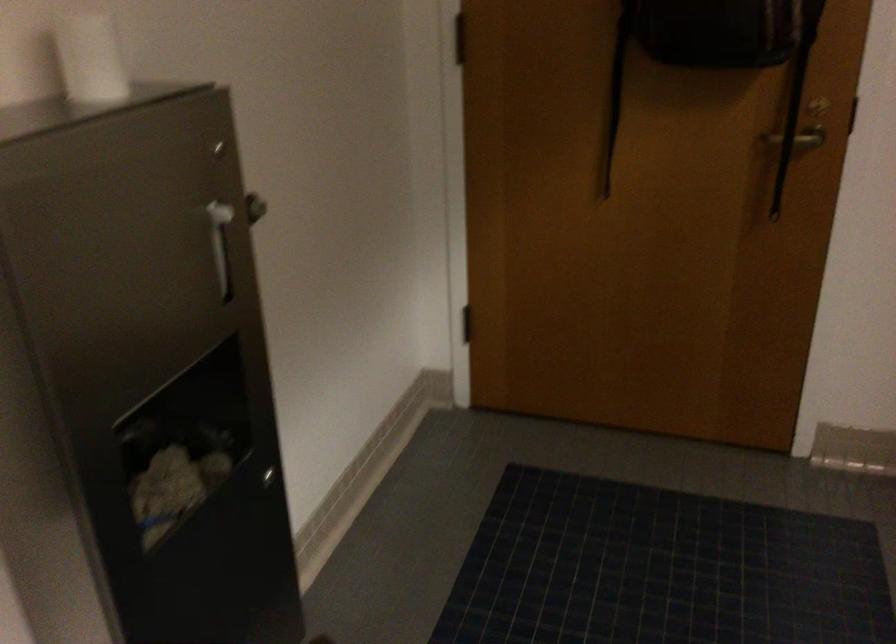
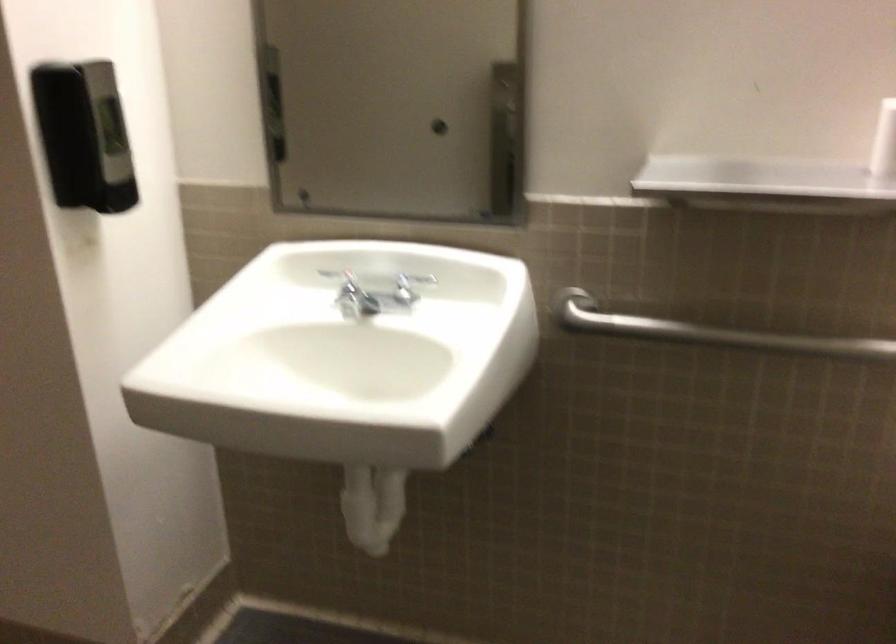
The images are taken continuously from a first-person perspective. In which direction is your viewpoint rotating?

The camera's rotation is toward right-down.